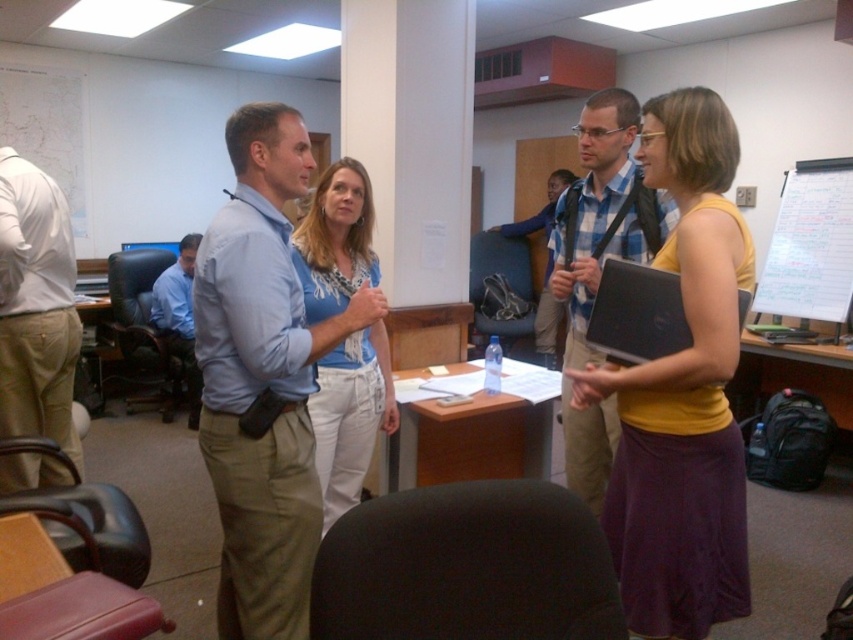
You are standing in the office scene described. Where exactly is the white matte shirt at left located in terms of coordinates?

The white matte shirt at left is located at point coordinates of (36, 307).

You are an office worker who needs to sit down. You see a matte yellow tank top at center and a black fabric swivel chair at center. Which object can you sit on?

The black fabric swivel chair at center is behind matte yellow tank top at center, so you can sit on the black fabric swivel chair at center.